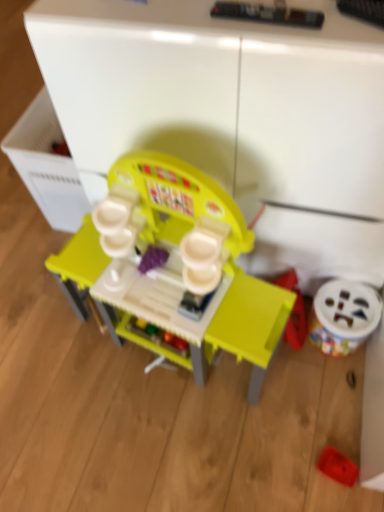
At what (x,y) coordinates should I click in order to perform the action: click on free point behind rubberized red tray at lower right, which is the second toy in left-to-right order. Please return your answer as a coordinate pair (x, y). The width and height of the screenshot is (384, 512). Looking at the image, I should click on (319, 407).